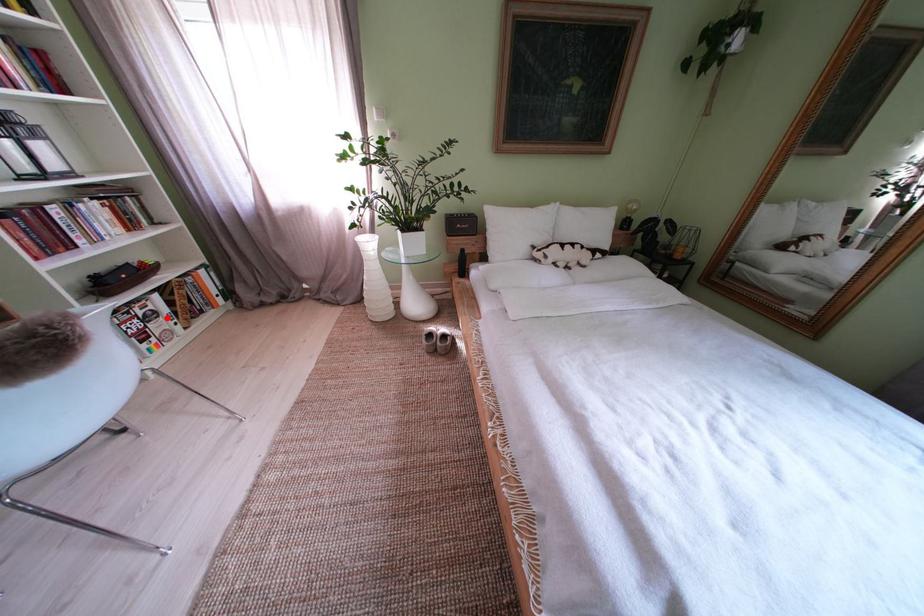
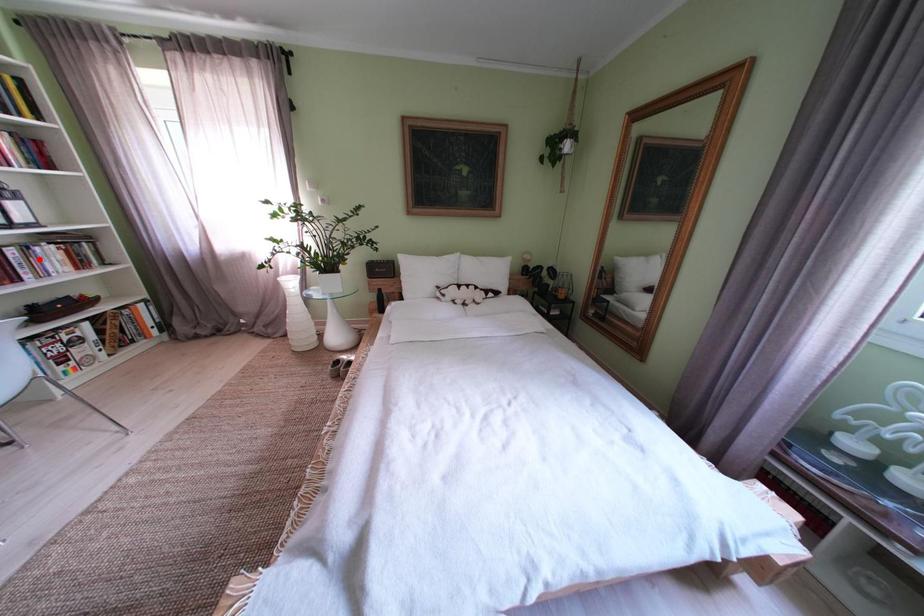
I am providing you with two images of the same scene from different viewpoints. A red point is marked on the first image and another point is marked on the second image. Are the points marked in image1 and image2 representing the same 3D position?

No